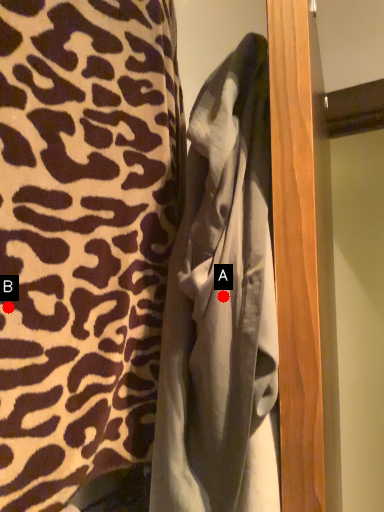
Question: Two points are circled on the image, labeled by A and B beside each circle. Which point is closer to the camera?

Choices:
 (A) A is closer
 (B) B is closer

Answer: (B)